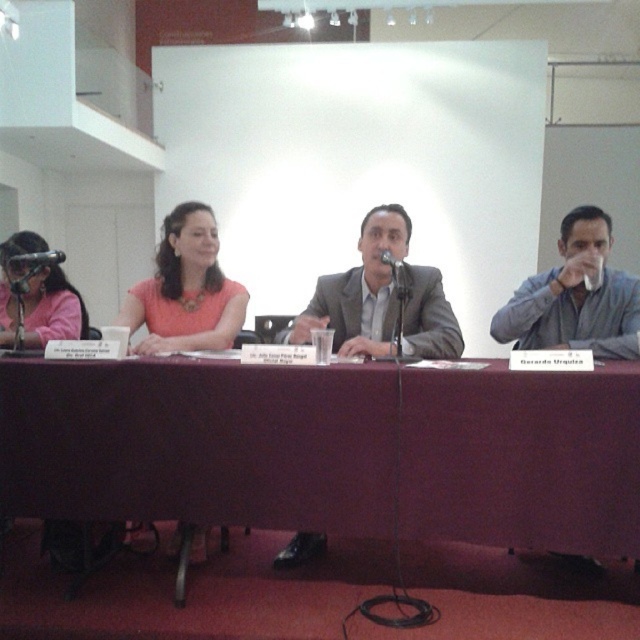
Is point (536, 336) farther from camera compared to point (22, 243)?

No, it is in front of (22, 243).

Who is lower down, matte gray shirt at right or matte pink shirt at left?

matte gray shirt at right is lower down.

Between point (605, 228) and point (56, 305), which one is positioned in front?

Point (605, 228)

At what (x,y) coordinates should I click in order to perform the action: click on matte gray shirt at right. Please return your answer as a coordinate pair (x, y). The width and height of the screenshot is (640, 640). Looking at the image, I should click on (576, 296).

In the scene shown: Who is more distant from viewer, (595, 314) or (195, 552)?

The point (195, 552) is behind.

Which is above, matte gray shirt at right or matte pink dress at center?

Positioned higher is matte pink dress at center.

What do you see at coordinates (576, 296) in the screenshot?
I see `matte gray shirt at right` at bounding box center [576, 296].

The image size is (640, 640). I want to click on matte gray shirt at right, so click(x=576, y=296).

Does maroon fabric table at center appear on the left side of matte pink dress at center?

In fact, maroon fabric table at center is to the right of matte pink dress at center.

Who is positioned more to the left, maroon fabric table at center or matte pink dress at center?

Positioned to the left is matte pink dress at center.

Locate an element on the screen. maroon fabric table at center is located at coordinates (330, 449).